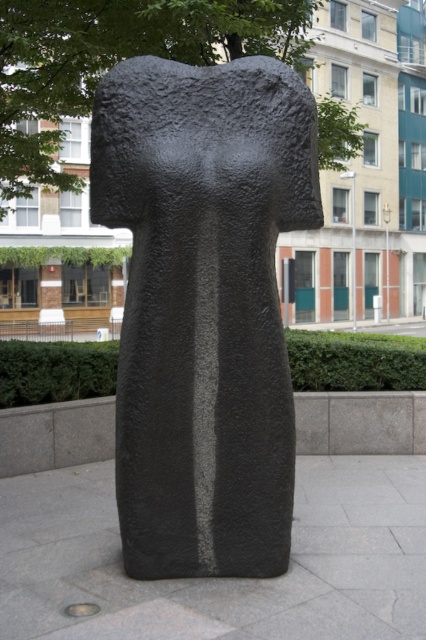
Is black rough stone statue at center above green leafy tree at upper center?

Actually, black rough stone statue at center is below green leafy tree at upper center.

Can you confirm if black rough stone statue at center is taller than green leafy tree at upper center?

Incorrect, black rough stone statue at center's height is not larger of green leafy tree at upper center's.

You are a GUI agent. You are given a task and a screenshot of the screen. Output one action in this format:
    pyautogui.click(x=<x>, y=<y>)
    Task: Click on the black rough stone statue at center
    Image resolution: width=426 pixels, height=640 pixels.
    Given the screenshot: What is the action you would take?
    pyautogui.click(x=204, y=307)